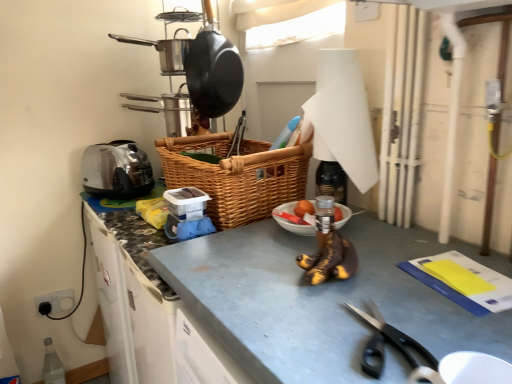
Question: Is black plastic scissors at lower right bigger than matte black frying pan at upper center, which appears as the first frying pan when viewed from the right?

Choices:
 (A) yes
 (B) no

Answer: (B)

Question: Could you tell me if black plastic scissors at lower right is turned towards matte black frying pan at upper center, which appears as the second frying pan when viewed from the left?

Choices:
 (A) no
 (B) yes

Answer: (A)

Question: Would you say black plastic scissors at lower right is outside matte black frying pan at upper center, which appears as the second frying pan when viewed from the left?

Choices:
 (A) yes
 (B) no

Answer: (A)

Question: Considering the relative positions of black plastic scissors at lower right and matte black frying pan at upper center, which appears as the second frying pan when viewed from the left, in the image provided, is black plastic scissors at lower right in front of matte black frying pan at upper center, which appears as the second frying pan when viewed from the left,?

Choices:
 (A) no
 (B) yes

Answer: (B)

Question: From a real-world perspective, is black plastic scissors at lower right beneath matte black frying pan at upper center, which appears as the first frying pan when viewed from the right?

Choices:
 (A) yes
 (B) no

Answer: (A)

Question: Is matte black frying pan at upper center, which appears as the first frying pan when viewed from the right, to the left or to the right of black plastic scissors at lower right in the image?

Choices:
 (A) right
 (B) left

Answer: (B)

Question: Is matte black frying pan at upper center, which appears as the second frying pan when viewed from the left, spatially inside black plastic scissors at lower right, or outside of it?

Choices:
 (A) inside
 (B) outside

Answer: (B)

Question: Considering the positions of point (198, 52) and point (384, 339), is point (198, 52) closer or farther from the camera than point (384, 339)?

Choices:
 (A) closer
 (B) farther

Answer: (B)

Question: Is matte black frying pan at upper center, which appears as the second frying pan when viewed from the left, in front of or behind black plastic scissors at lower right in the image?

Choices:
 (A) behind
 (B) front

Answer: (A)

Question: In the image, is smooth gray countertop at center positioned in front of or behind black plastic scissors at lower right?

Choices:
 (A) front
 (B) behind

Answer: (A)

Question: Is smooth gray countertop at center bigger or smaller than black plastic scissors at lower right?

Choices:
 (A) small
 (B) big

Answer: (B)

Question: Is point (418, 233) closer or farther from the camera than point (432, 359)?

Choices:
 (A) closer
 (B) farther

Answer: (B)

Question: Looking at their shapes, would you say smooth gray countertop at center is wider or thinner than black plastic scissors at lower right?

Choices:
 (A) wide
 (B) thin

Answer: (A)

Question: In the image, is black plastic scissors at lower right positioned in front of or behind matte black frying pan at upper center, which appears as the second frying pan when viewed from the left?

Choices:
 (A) front
 (B) behind

Answer: (A)

Question: Visually, is black plastic scissors at lower right positioned to the left or to the right of matte black frying pan at upper center, which appears as the first frying pan when viewed from the right?

Choices:
 (A) right
 (B) left

Answer: (A)